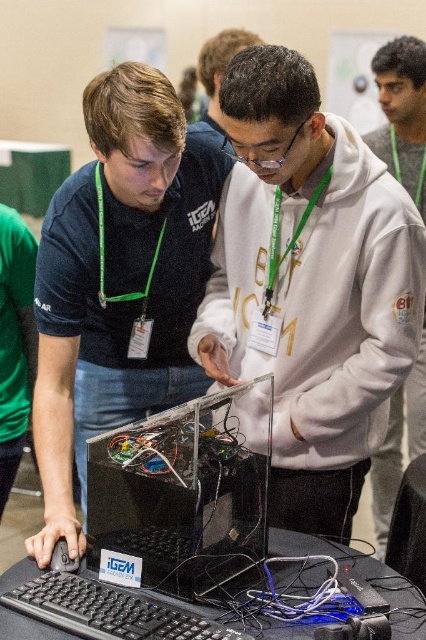
Does matte black shirt at left come behind black plastic keyboard at lower left?

Yes, it is.

Which of these two, matte black shirt at left or black plastic keyboard at lower left, stands taller?

matte black shirt at left is taller.

The height and width of the screenshot is (640, 426). Identify the location of matte black shirt at left. (118, 280).

In the scene shown: Measure the distance between white matte hoodie at center and transparent plastic computer at center.

The distance of white matte hoodie at center from transparent plastic computer at center is 12.51 inches.

Is point (310, 109) behind point (198, 488)?

Yes, it is behind point (198, 488).

Is point (287, 154) farther from viewer compared to point (100, 452)?

Yes, point (287, 154) is behind point (100, 452).

At what (x,y) coordinates should I click in order to perform the action: click on white matte hoodie at center. Please return your answer as a coordinate pair (x, y). The width and height of the screenshot is (426, 640). Looking at the image, I should click on (310, 285).

Does matte black shirt at left appear over white fleece hoodie at center?

Yes.

Can you confirm if matte black shirt at left is positioned below white fleece hoodie at center?

Actually, matte black shirt at left is above white fleece hoodie at center.

Who is more distant from viewer, (146, 161) or (408, 128)?

The point (408, 128) is behind.

You are a GUI agent. You are given a task and a screenshot of the screen. Output one action in this format:
    pyautogui.click(x=<x>, y=<y>)
    Task: Click on the matte black shirt at left
    
    Given the screenshot: What is the action you would take?
    pyautogui.click(x=118, y=280)